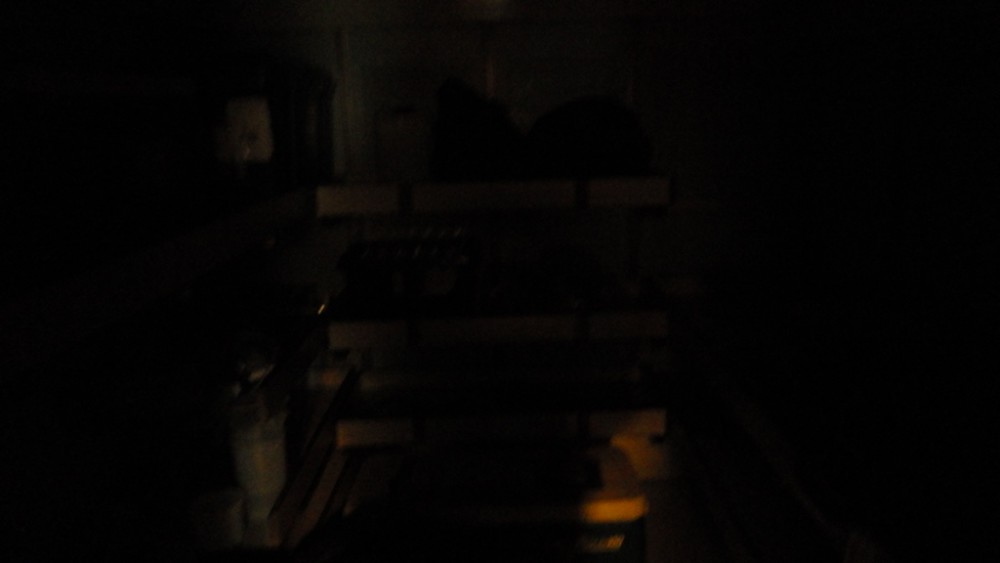
I want to click on light, so click(630, 469).